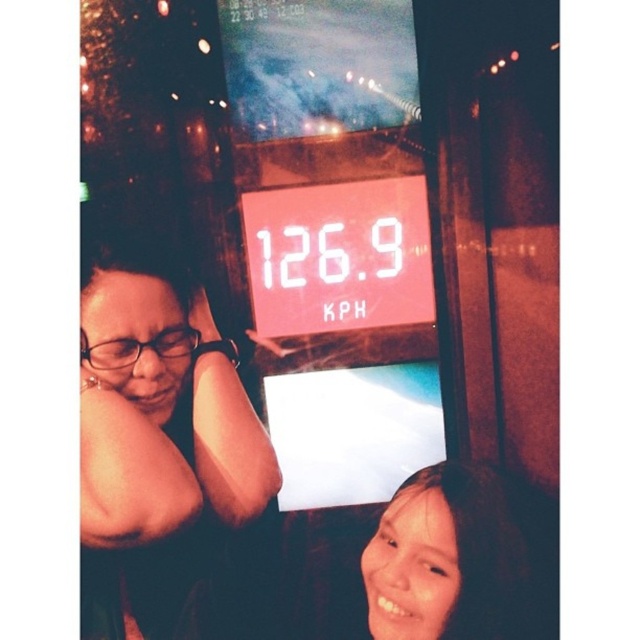
This screenshot has height=640, width=640. Describe the element at coordinates (160, 445) in the screenshot. I see `matte black glasses at left` at that location.

Which is more to the right, matte black glasses at left or white digital display at center?

white digital display at center is more to the right.

Is point (156, 451) closer to viewer compared to point (380, 193)?

Yes, it is in front of point (380, 193).

Locate an element on the screen. The image size is (640, 640). matte black glasses at left is located at coordinates [x=160, y=445].

Does white digital display at center come behind smooth skin face at lower right?

Yes, it is.

Between white digital display at center and smooth skin face at lower right, which one is positioned lower?

smooth skin face at lower right

Is point (332, 250) closer to camera compared to point (435, 582)?

No, it is behind (435, 582).

Find the location of a particular element. The width and height of the screenshot is (640, 640). white digital display at center is located at coordinates (339, 256).

Who is taller, matte black glasses at left or smooth skin face at lower right?

With more height is matte black glasses at left.

Which of these two, matte black glasses at left or smooth skin face at lower right, stands shorter?

smooth skin face at lower right

Does point (138, 611) come in front of point (378, 579)?

No, it is not.

At what (x,y) coordinates should I click in order to perform the action: click on matte black glasses at left. Please return your answer as a coordinate pair (x, y). The height and width of the screenshot is (640, 640). Looking at the image, I should click on (160, 445).